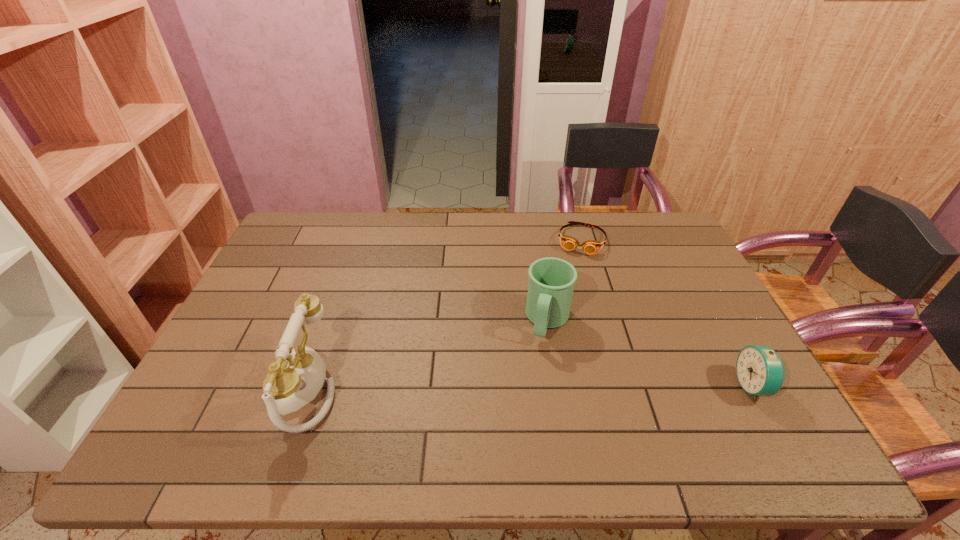
Where is `the leftmost object`? Image resolution: width=960 pixels, height=540 pixels. the leftmost object is located at coordinates (297, 376).

Where is `telephone`? telephone is located at coordinates (297, 376).

The image size is (960, 540). I want to click on the rightmost object, so click(760, 371).

The image size is (960, 540). I want to click on alarm clock, so pyautogui.click(x=760, y=371).

At what (x,y) coordinates should I click in order to perform the action: click on the third object from left to right. Please return your answer as a coordinate pair (x, y). The image size is (960, 540). Looking at the image, I should click on (590, 247).

Where is `the farthest object`? This screenshot has width=960, height=540. the farthest object is located at coordinates (590, 247).

The image size is (960, 540). I want to click on mug, so click(x=551, y=283).

Find the location of `the third shortest object`. the third shortest object is located at coordinates coord(551,283).

The width and height of the screenshot is (960, 540). Find the location of `free space located 0.050m on the dial of the telephone`. free space located 0.050m on the dial of the telephone is located at coordinates (247, 388).

Where is `vacant area located 0.120m on the dial of the telephone`? vacant area located 0.120m on the dial of the telephone is located at coordinates (218, 388).